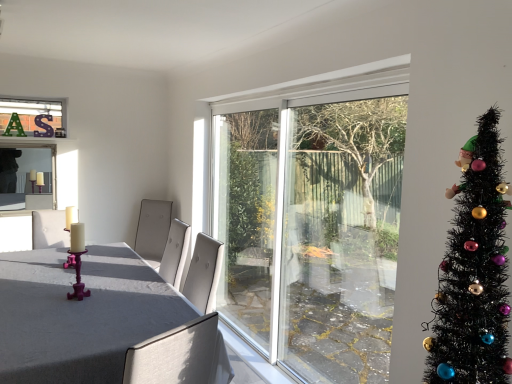
Locate an element on the screen. The height and width of the screenshot is (384, 512). empty space that is ontop of matte glass candlesticks at left (from a real-world perspective) is located at coordinates (21, 141).